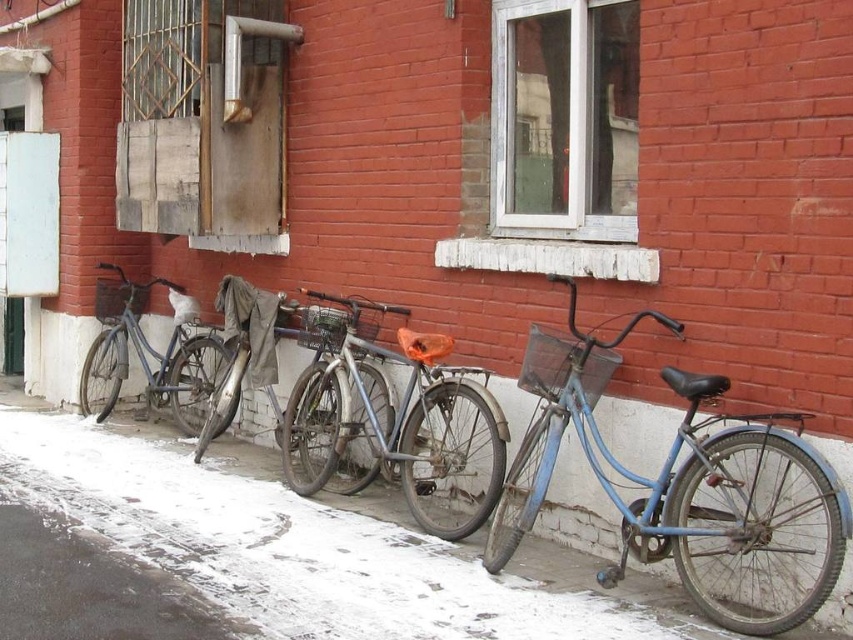
Question: Does blue matte bicycle at center have a greater width compared to shiny metallic bicycle at center?

Choices:
 (A) no
 (B) yes

Answer: (A)

Question: Is blue matte bicycle at center in front of matte blue bicycle at left?

Choices:
 (A) yes
 (B) no

Answer: (A)

Question: Which point is closer to the camera?

Choices:
 (A) shiny metallic bicycle at center
 (B) blue matte bicycle at center
 (C) white snow at lower left
 (D) matte blue bicycle at left

Answer: (B)

Question: Is shiny metallic bicycle at center behind matte blue bicycle at left?

Choices:
 (A) yes
 (B) no

Answer: (B)

Question: Which object appears closest to the camera in this image?

Choices:
 (A) shiny metallic bicycle at center
 (B) white snow at lower left
 (C) blue matte bicycle at center
 (D) matte blue bicycle at left

Answer: (C)

Question: Which point is closer to the camera?

Choices:
 (A) (375, 508)
 (B) (120, 369)

Answer: (A)